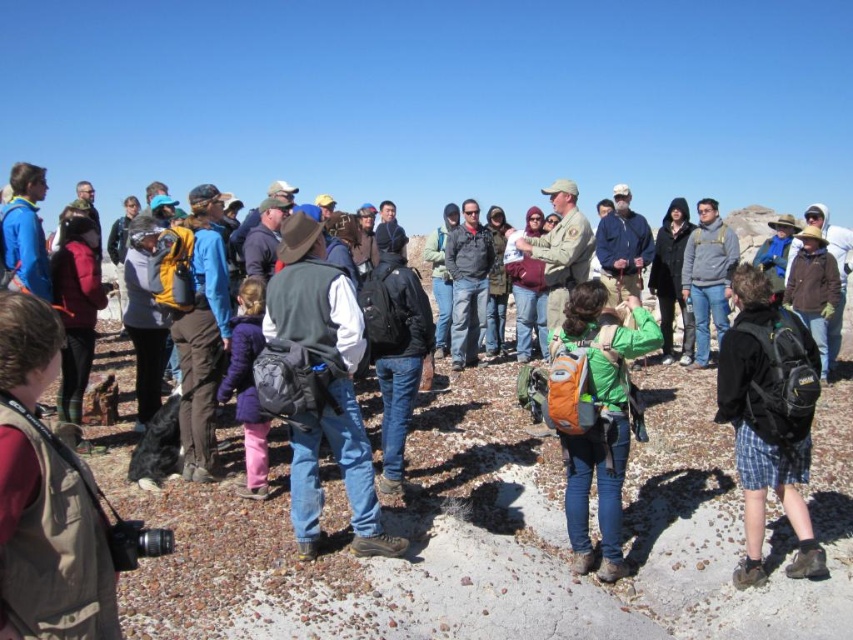
Looking at this image, you are a photographer trying to capture a photo of the group. You notice the brown suede vest at lower left and the green fabric backpack at center. Which object should you adjust your camera focus on if you want to capture the closer object?

The brown suede vest at lower left has a lesser height compared to the green fabric backpack at center, so the brown suede vest at lower left is closer to the camera and should be focused on.

In the scene shown: You are a photographer standing at the lower left corner of the scene. You want to take a photo of the green fabric backpack at center without moving from your current position. Is the brown suede vest at lower left blocking your view of the backpack?

The brown suede vest at lower left is 14.57 feet away from the green fabric backpack at center. Since the distance between them is significant, the brown suede vest at lower left is unlikely to block the view of the backpack unless there are other obstructions not mentioned in the scene description.